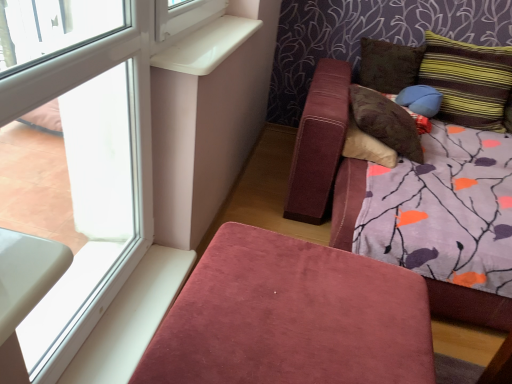
Question: From the image's perspective, is blue fabric pillow at upper right, arranged as the second pillow when viewed from the right, under brown suede pillow at upper right, which ranks as the third pillow in right-to-left order?

Choices:
 (A) yes
 (B) no

Answer: (A)

Question: Does blue fabric pillow at upper right, which ranks as the third pillow in left-to-right order, come in front of brown suede pillow at upper right, which ranks as the third pillow in right-to-left order?

Choices:
 (A) yes
 (B) no

Answer: (A)

Question: From the image's perspective, would you say blue fabric pillow at upper right, arranged as the second pillow when viewed from the right, is positioned over brown suede pillow at upper right, which appears as the second pillow when viewed from the left?

Choices:
 (A) no
 (B) yes

Answer: (A)

Question: Is blue fabric pillow at upper right, arranged as the second pillow when viewed from the right, bigger than brown suede pillow at upper right, which appears as the second pillow when viewed from the left?

Choices:
 (A) no
 (B) yes

Answer: (A)

Question: Considering the relative sizes of blue fabric pillow at upper right, arranged as the second pillow when viewed from the right, and brown suede pillow at upper right, which ranks as the third pillow in right-to-left order, in the image provided, is blue fabric pillow at upper right, arranged as the second pillow when viewed from the right, wider than brown suede pillow at upper right, which ranks as the third pillow in right-to-left order,?

Choices:
 (A) no
 (B) yes

Answer: (B)

Question: Is white plastic window sill at upper left inside or outside of blue fabric pillow at upper right, arranged as the second pillow when viewed from the right?

Choices:
 (A) outside
 (B) inside

Answer: (A)

Question: Looking at their shapes, would you say white plastic window sill at upper left is wider or thinner than blue fabric pillow at upper right, arranged as the second pillow when viewed from the right?

Choices:
 (A) thin
 (B) wide

Answer: (A)

Question: From the image's perspective, is white plastic window sill at upper left above or below blue fabric pillow at upper right, arranged as the second pillow when viewed from the right?

Choices:
 (A) below
 (B) above

Answer: (B)

Question: Looking at the image, does white plastic window sill at upper left seem bigger or smaller compared to blue fabric pillow at upper right, which ranks as the third pillow in left-to-right order?

Choices:
 (A) big
 (B) small

Answer: (B)

Question: Looking at their shapes, would you say blue fabric pillow at upper right, which ranks as the third pillow in left-to-right order, is wider or thinner than transparent glass window at upper left?

Choices:
 (A) wide
 (B) thin

Answer: (A)

Question: From their relative heights in the image, would you say blue fabric pillow at upper right, which ranks as the third pillow in left-to-right order, is taller or shorter than transparent glass window at upper left?

Choices:
 (A) short
 (B) tall

Answer: (A)

Question: Is blue fabric pillow at upper right, arranged as the second pillow when viewed from the right, inside or outside of transparent glass window at upper left?

Choices:
 (A) outside
 (B) inside

Answer: (A)

Question: Is point (411, 104) positioned closer to the camera than point (82, 215)?

Choices:
 (A) farther
 (B) closer

Answer: (A)

Question: Considering their positions, is blue fabric pillow at upper right, arranged as the second pillow when viewed from the right, located in front of or behind velvet pink ottoman at lower center?

Choices:
 (A) front
 (B) behind

Answer: (B)

Question: From a real-world perspective, relative to velvet pink ottoman at lower center, is blue fabric pillow at upper right, which ranks as the third pillow in left-to-right order, vertically above or below?

Choices:
 (A) below
 (B) above

Answer: (B)